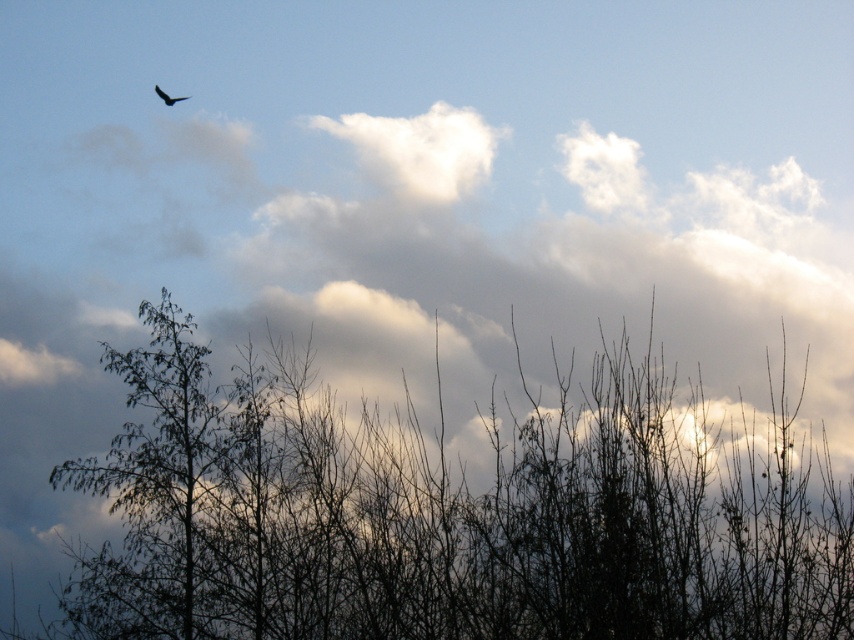
Based on the photo, does silhouette bare branches at center lie behind dark brown feathered bird at upper left?

No, silhouette bare branches at center is in front of dark brown feathered bird at upper left.

Where is `silhouette bare branches at center`? silhouette bare branches at center is located at coordinates (445, 513).